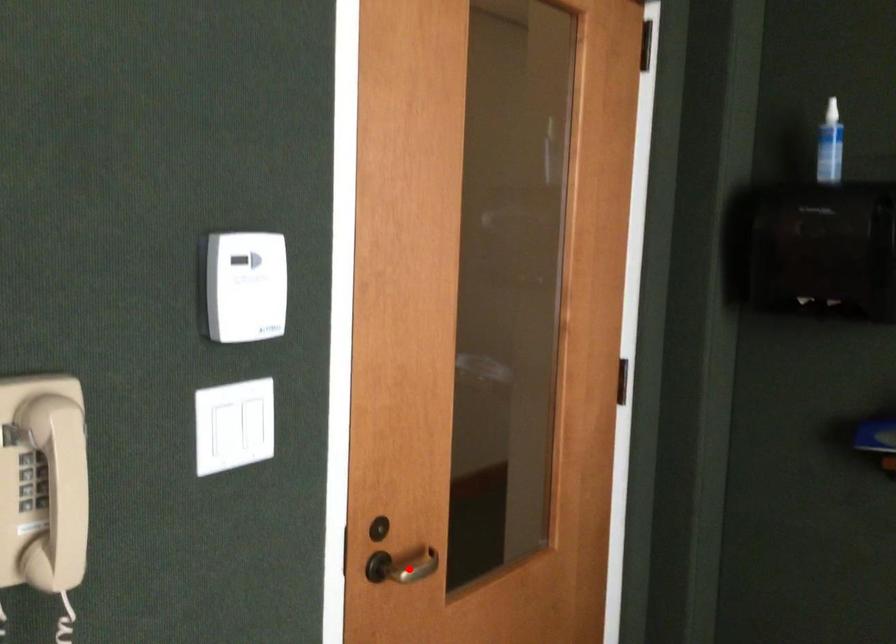
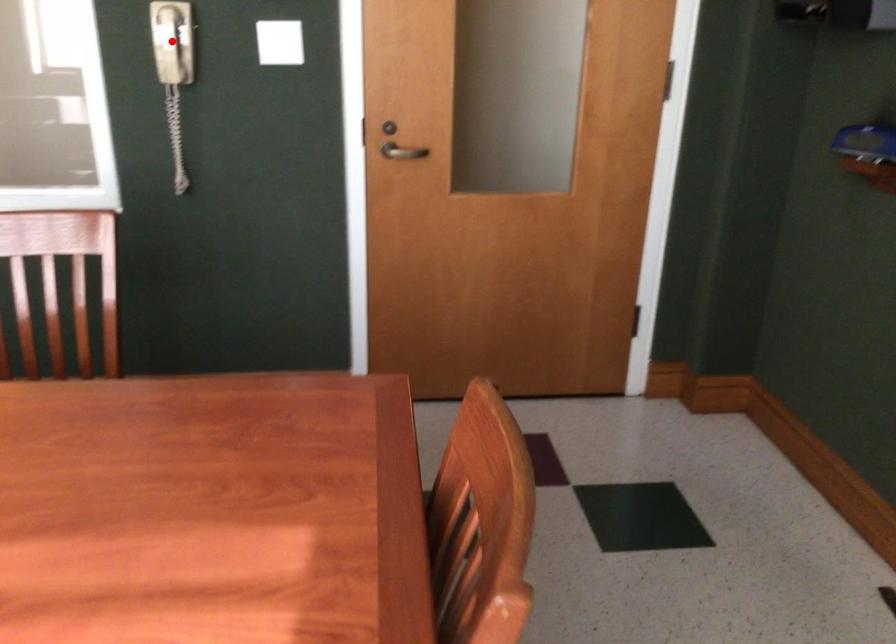
I am providing you with two images of the same scene from different viewpoints. A red point is marked on the first image and another point is marked on the second image. Are the points marked in image1 and image2 representing the same 3D position?

No